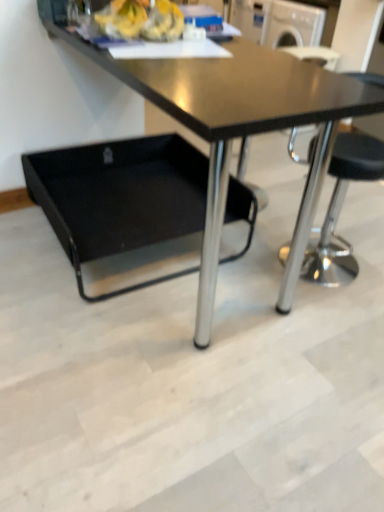
Image resolution: width=384 pixels, height=512 pixels. I want to click on free spot above black glossy table at center (from a real-world perspective), so click(x=223, y=65).